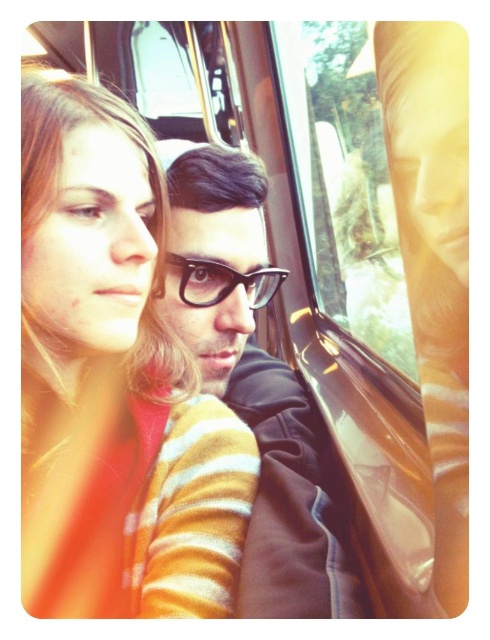
You are a passenger on a train and want to check the view outside through the transparent glass train window at upper center. However, you are wearing the black matte glasses at center. Will your glasses block your view of the window?

The black matte glasses at center is shorter than transparent glass train window at upper center, so the glasses will not block your view of the window since they are smaller in height.

You are a passenger in a moving vehicle and need to decide whether to place a small travel bag on the matte orange sweater at left or the transparent glass train window at upper center. Based on their sizes, which location would be more suitable for the bag?

The matte orange sweater at left has a smaller size compared to the transparent glass train window at upper center, so placing the small travel bag on the transparent glass train window at upper center would be more suitable due to its larger surface area.

You are a passenger on a train ride and you want to check the view outside through the transparent glass train window at upper center while wearing the matte orange sweater at left. Can you reach the window from your current position?

The matte orange sweater at left is to the left of the transparent glass train window at upper center, meaning the passenger wearing the matte orange sweater at left would need to move to the right to reach the window.